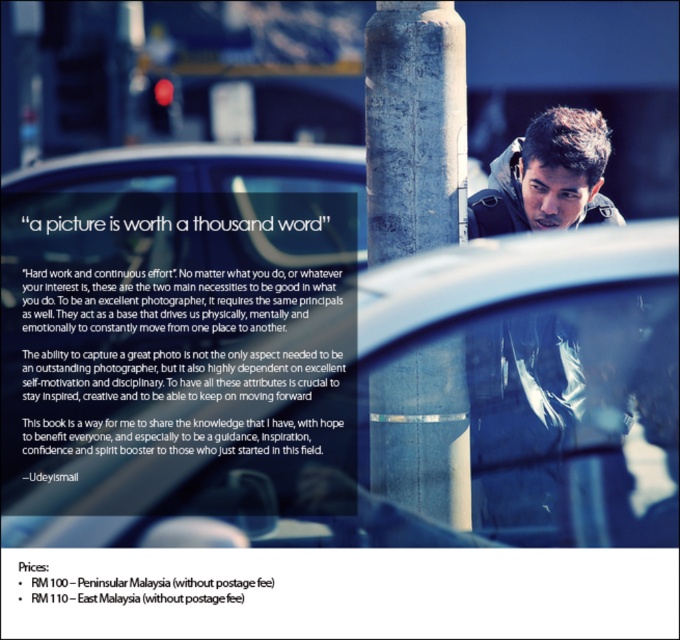
You are a photographer who wants to capture a subject in front of the pillar. You have two points marked on your viewfinder at coordinates point [541,512] and point [481,198]. Which point should you focus on to ensure the subject behind the pillar is in focus?

Point [541,512] is behind point [481,198], so focusing on point [481,198] will ensure the subject behind the pillar is in focus.

You are a photographer trying to capture a closeup of the clear glass car at center and the matte black jacket at upper right in the image. Given that your camera can only focus on objects within a 20 inch range, will you be able to capture both subjects clearly in one shot?

The clear glass car at center and the matte black jacket at upper right are 21.43 inches apart. Since the distance between them exceeds the camera focus range of 20 inches, you won

You are a fashion designer analyzing a photo for a new collection. You notice two jackets in the image. The first is a dark gray jacket at center and the second is a matte black jacket at upper right. Based on the image, which jacket appears bigger in size?

The dark gray jacket at center is larger in size than the matte black jacket at upper right, so the dark gray jacket at center appears bigger in size.